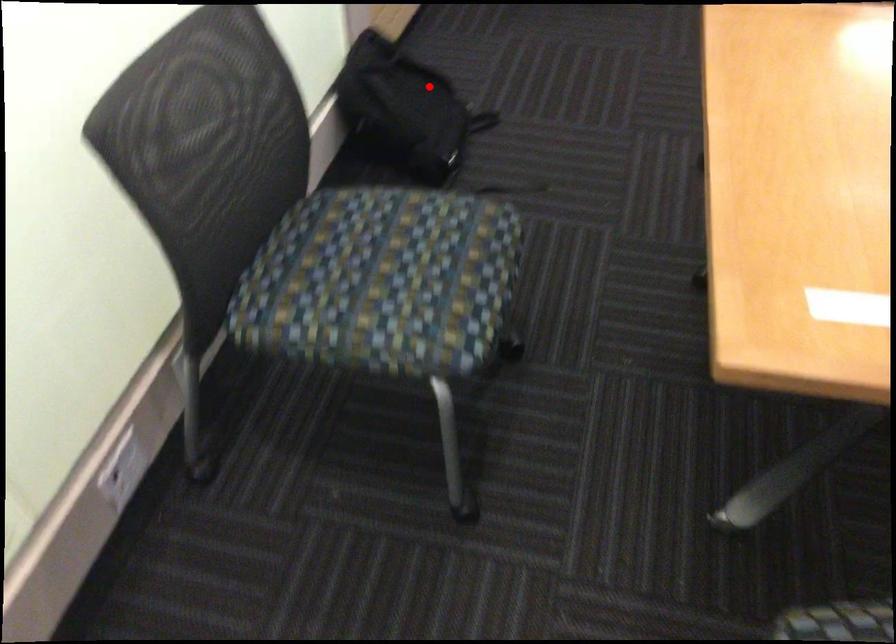
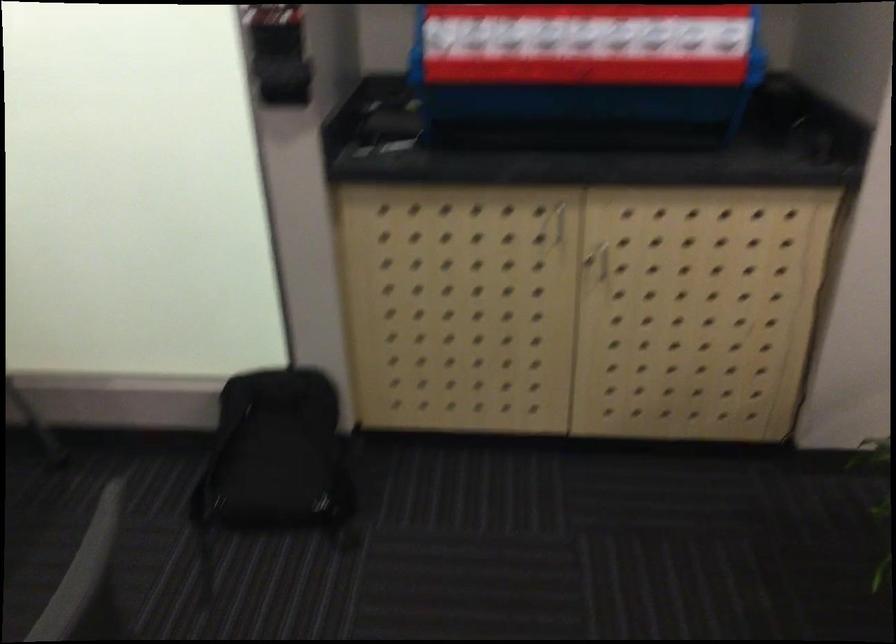
Question: I am providing you with two images of the same scene from different viewpoints. A red point is marked on the first image. Can you still see the location of the red point in image 2?

Choices:
 (A) Yes
 (B) No

Answer: (A)